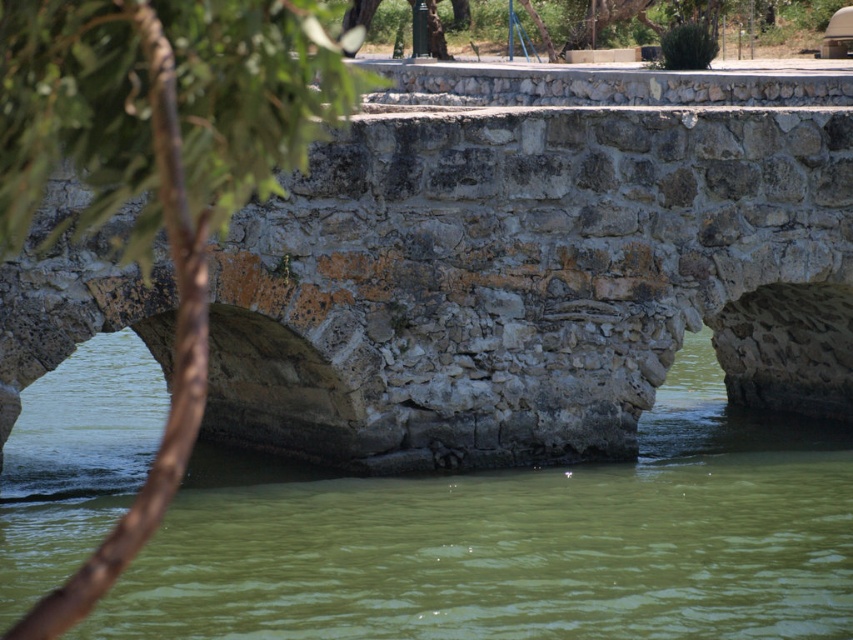
Between green stone river at center and green leafy branch at left, which one is positioned lower?

green stone river at center is below.

Can you confirm if green stone river at center is positioned above green leafy branch at left?

No, green stone river at center is not above green leafy branch at left.

Is point (759, 458) more distant than point (183, 420)?

That is False.

The image size is (853, 640). Identify the location of green stone river at center. (515, 540).

Looking at this image, between green stone river at center and green leafy tree at upper center, which one has less height?

green stone river at center is shorter.

Which of these two, green stone river at center or green leafy tree at upper center, stands taller?

green leafy tree at upper center

Is point (413, 596) behind point (488, 8)?

That is False.

The width and height of the screenshot is (853, 640). Identify the location of green stone river at center. (515, 540).

Between point (178, 371) and point (791, 8), which one is positioned in front?

Point (178, 371) is in front.

Which is behind, point (329, 60) or point (641, 3)?

Positioned behind is point (641, 3).

The width and height of the screenshot is (853, 640). I want to click on green leafy branch at left, so click(x=157, y=170).